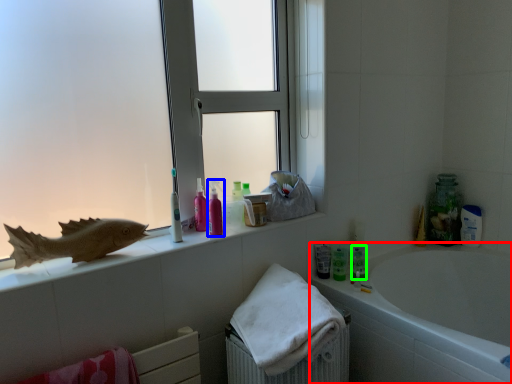
Question: Estimate the real-world distances between objects in this image. Which object is farther from bathtub (highlighted by a red box), mouthwash (highlighted by a blue box) or toiletry (highlighted by a green box)?

Choices:
 (A) mouthwash
 (B) toiletry

Answer: (A)